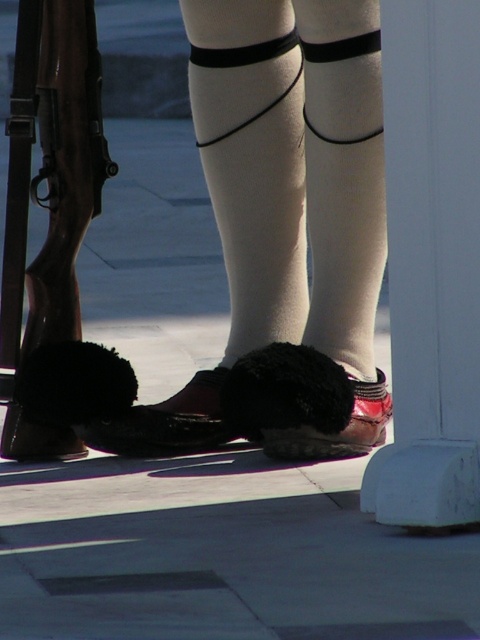
Question: Among these points, which one is farthest from the camera?

Choices:
 (A) (96, 422)
 (B) (71, 308)
 (C) (230, 29)
 (D) (271, 392)

Answer: (B)

Question: In this image, where is shiny black shoe at center located relative to shiny brown shoe at center?

Choices:
 (A) below
 (B) above

Answer: (B)

Question: Based on their relative distances, which object is nearer to the wooden stock shotgun at left?

Choices:
 (A) shiny brown shoe at center
 (B) shiny black shoe at center
 (C) white smooth socks at center

Answer: (C)

Question: Is white smooth socks at center closer to camera compared to wooden stock shotgun at left?

Choices:
 (A) no
 (B) yes

Answer: (A)

Question: Which point is closer to the camera taking this photo?

Choices:
 (A) (204, 42)
 (B) (90, 426)
 (C) (27, 102)
 (D) (265, 401)

Answer: (D)

Question: Does white smooth socks at center have a smaller size compared to wooden stock shotgun at left?

Choices:
 (A) yes
 (B) no

Answer: (B)